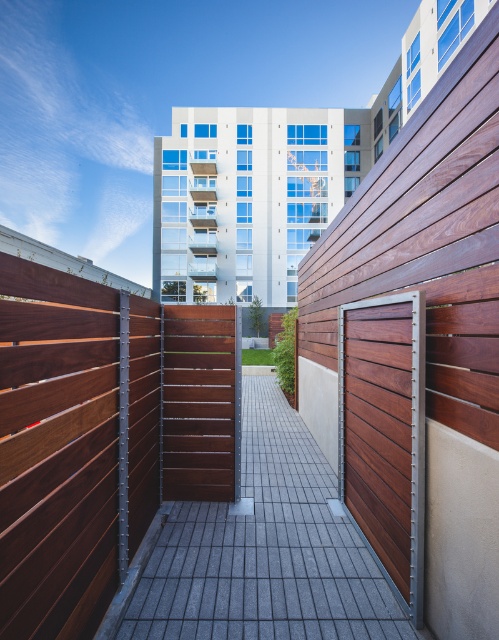
Question: Which of the following is the farthest from the observer?

Choices:
 (A) [290, 428]
 (B) [395, 369]
 (C) [33, 432]

Answer: (A)

Question: Which object appears farthest from the camera in this image?

Choices:
 (A) matte wood fence at center
 (B) wooden slats door at center

Answer: (B)

Question: Is matte wood fence at center bigger than wooden slats door at center?

Choices:
 (A) no
 (B) yes

Answer: (B)

Question: Is matte wood fence at center behind smooth gray stone path at center?

Choices:
 (A) no
 (B) yes

Answer: (A)

Question: Which object appears farthest from the camera in this image?

Choices:
 (A) wooden slats door at center
 (B) smooth gray stone path at center
 (C) matte wood fence at center

Answer: (B)

Question: Is smooth gray stone path at center positioned before wooden slats door at center?

Choices:
 (A) no
 (B) yes

Answer: (A)